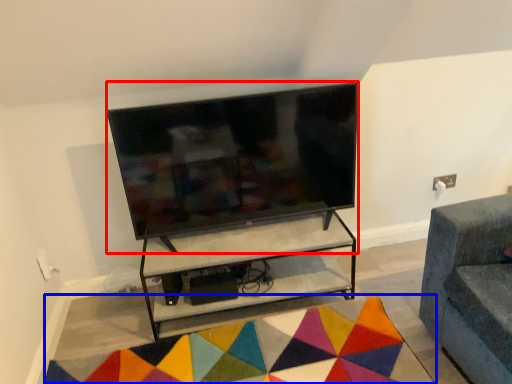
Question: Among these objects, which one is nearest to the camera, television (highlighted by a red box) or mat (highlighted by a blue box)?

Choices:
 (A) television
 (B) mat

Answer: (B)